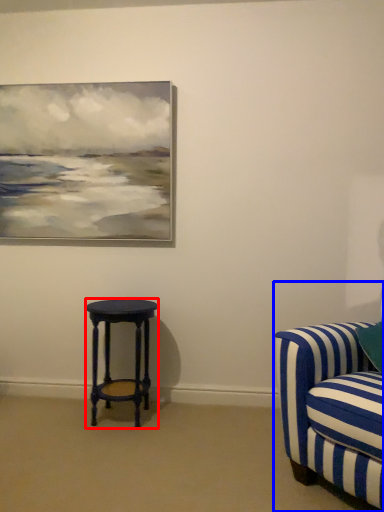
Question: Which point is further to the camera, stool (highlighted by a red box) or studio couch (highlighted by a blue box)?

Choices:
 (A) stool
 (B) studio couch

Answer: (A)